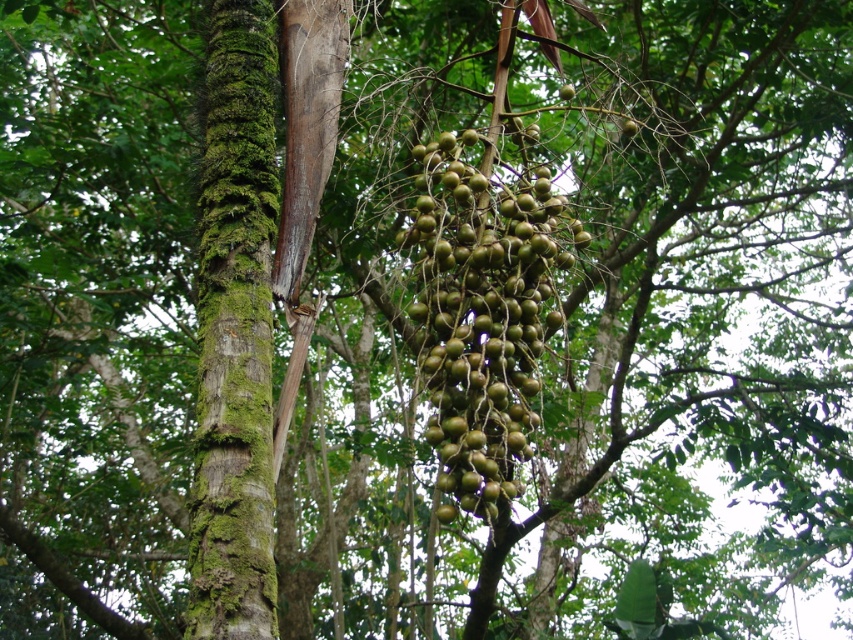
Which is in front, point (215, 612) or point (491, 310)?

Point (215, 612)

Is green mossy bark at center closer to camera compared to green matte cluster at center?

Yes, green mossy bark at center is closer to the viewer.

Which is behind, point (225, 282) or point (531, 282)?

The point (225, 282) is behind.

This screenshot has height=640, width=853. What are the coordinates of `green mossy bark at center` in the screenshot? It's located at (234, 332).